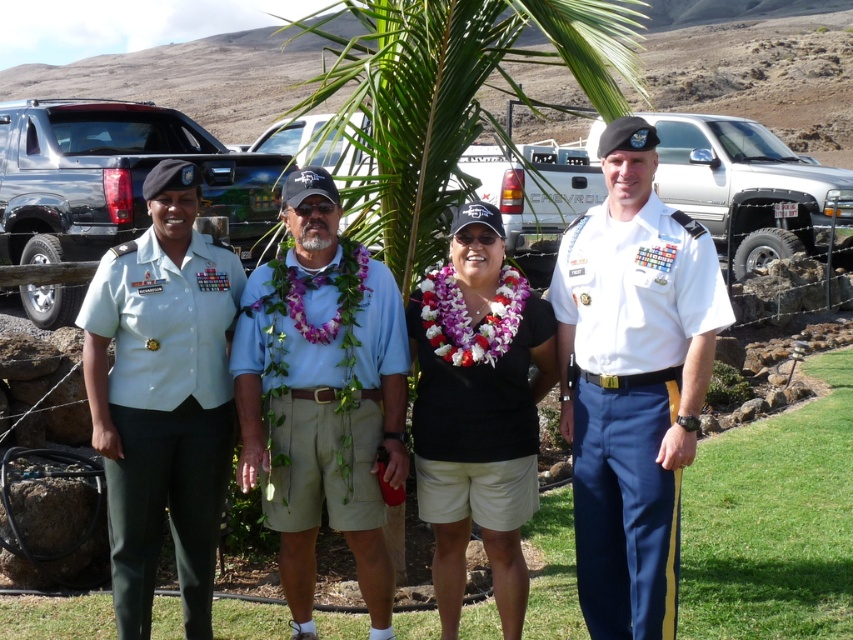
Question: Which is farther from the blue cotton shirt at center?

Choices:
 (A) white cotton shirt at center
 (B) light blue fabric uniform at left
 (C) black fabric lei at center

Answer: (A)

Question: Where is white cotton shirt at center located in relation to light blue fabric uniform at left in the image?

Choices:
 (A) left
 (B) right

Answer: (B)

Question: Does white cotton shirt at center come in front of light blue fabric uniform at left?

Choices:
 (A) no
 (B) yes

Answer: (B)

Question: Is white cotton shirt at center below light blue fabric uniform at left?

Choices:
 (A) no
 (B) yes

Answer: (A)

Question: Which of the following is the closest to the observer?

Choices:
 (A) white cotton shirt at center
 (B) black fabric lei at center
 (C) blue cotton shirt at center
 (D) light blue fabric uniform at left

Answer: (A)

Question: Which point appears closest to the camera in this image?

Choices:
 (A) (462, 236)
 (B) (575, 534)
 (C) (195, 406)

Answer: (A)